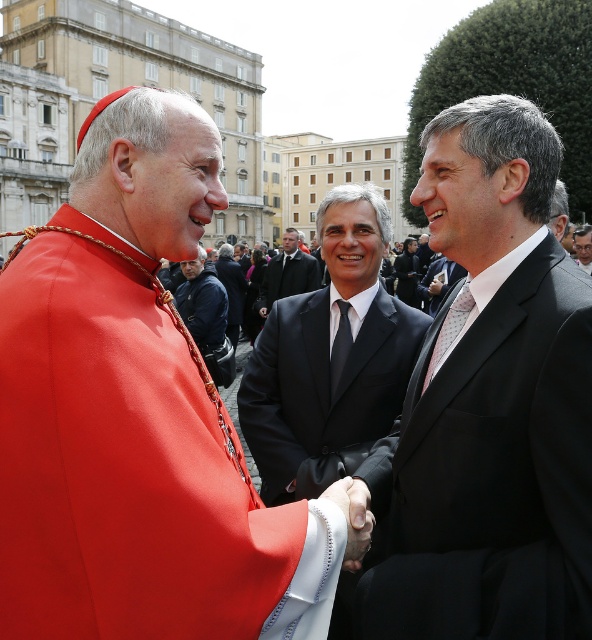
Question: Which object appears closest to the camera in this image?

Choices:
 (A) matte black suit at center
 (B) smooth black suit at center
 (C) dark gray suit at center

Answer: (A)

Question: Can you confirm if matte black suit at center is bigger than black suit at center?

Choices:
 (A) yes
 (B) no

Answer: (A)

Question: In this image, where is matte black suit at center located relative to black suit at center?

Choices:
 (A) left
 (B) right

Answer: (A)

Question: Can you confirm if matte red cassock at center is bigger than dark gray suit at center?

Choices:
 (A) yes
 (B) no

Answer: (A)

Question: Among these objects, which one is farthest from the camera?

Choices:
 (A) black satin suit at center
 (B) matte red cassock at center

Answer: (A)

Question: Which object appears closest to the camera in this image?

Choices:
 (A) matte black suit at center
 (B) dark gray suit at center

Answer: (A)